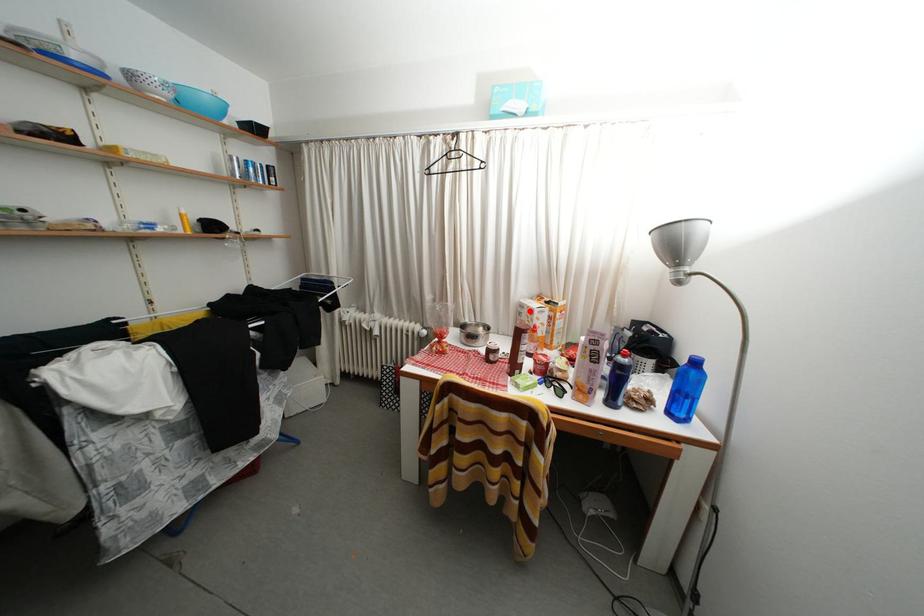
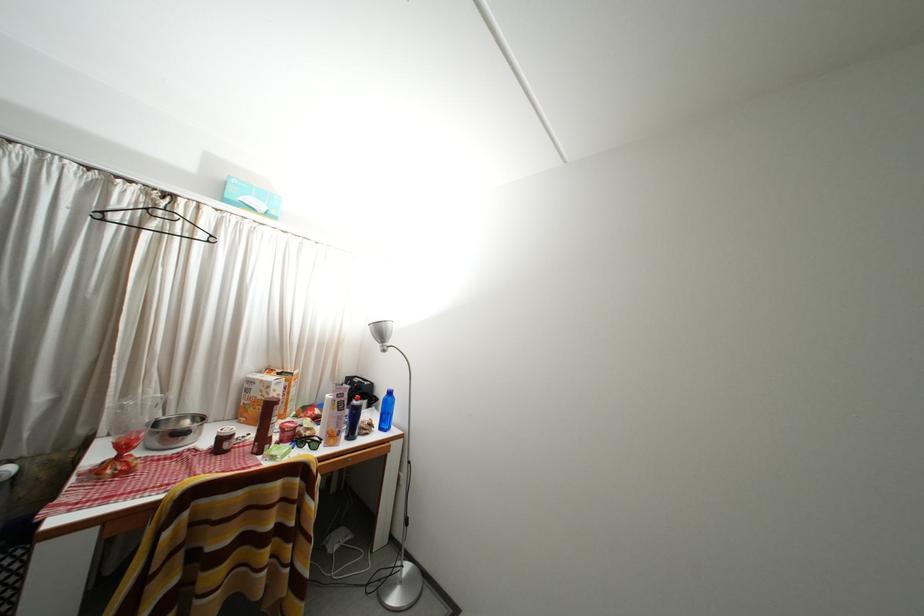
Where in the second image is the point corresponding to the highlighted location from the first image?

(259, 387)